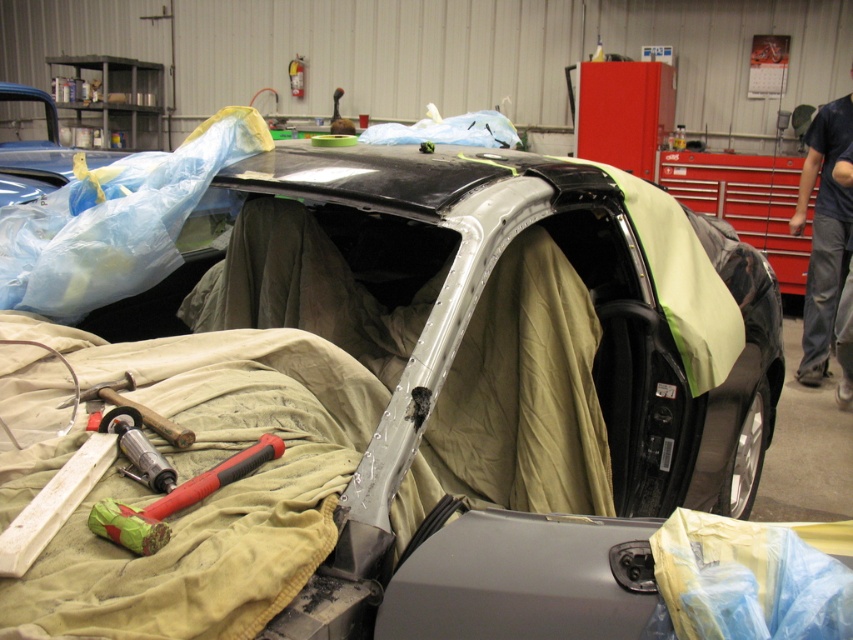
You are a mechanic working on a car in a garage. You need to access a point located at point [450,464] and another at point [831,221]. Which point is closer to you from your current position in the garage?

Point [450,464] is in front of point [831,221], so it is closer to you.

You are an inspector in the garage. You see a point at coordinate [822,234]. What object is located at that point?

The point at coordinate [822,234] indicates the dark blue shirt at right.

You are an automotive technician working in a garage. You need to place a dark blue shirt at right on top of the metallic silver car at center. Is the shirt large enough to cover the entire car?

The metallic silver car at center has a larger size compared to dark blue shirt at right, so the shirt is not large enough to cover the entire car.